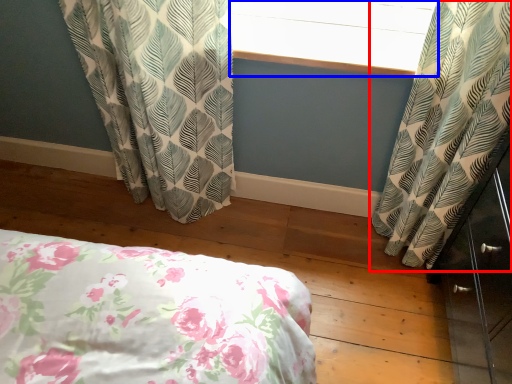
Question: Which of the following is the closest to the observer, curtain (highlighted by a red box) or window screen (highlighted by a blue box)?

Choices:
 (A) curtain
 (B) window screen

Answer: (A)